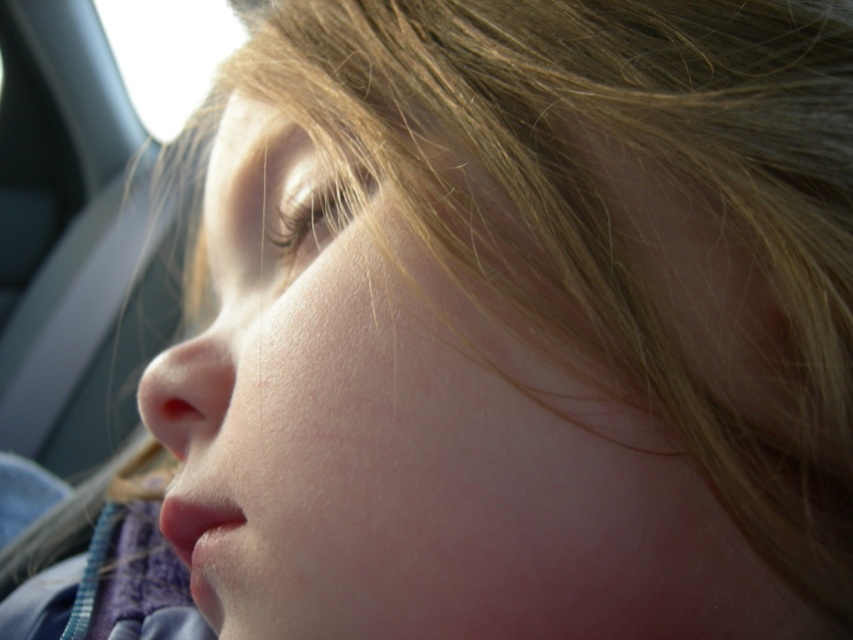
Question: Can you confirm if transparent glass car window at upper left is bigger than smooth skin nose at center?

Choices:
 (A) no
 (B) yes

Answer: (B)

Question: Is transparent glass car window at upper left closer to the viewer compared to smooth skin nose at center?

Choices:
 (A) no
 (B) yes

Answer: (A)

Question: Does transparent glass car window at upper left appear under smooth skin nose at center?

Choices:
 (A) no
 (B) yes

Answer: (A)

Question: Which object is closer to the camera taking this photo?

Choices:
 (A) smooth skin nose at center
 (B) transparent glass car window at upper left

Answer: (A)

Question: Which point appears closest to the camera in this image?

Choices:
 (A) (161, 61)
 (B) (154, 380)

Answer: (B)